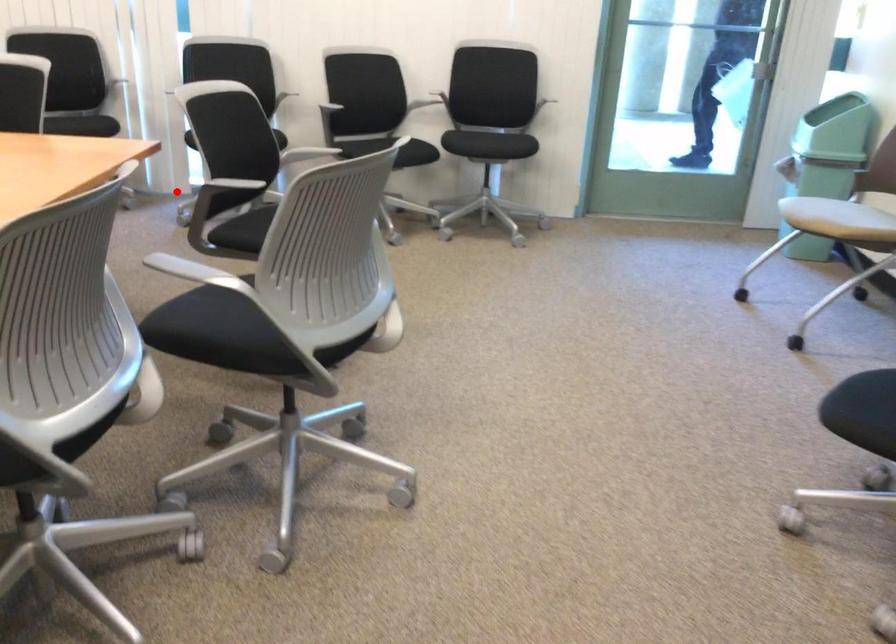
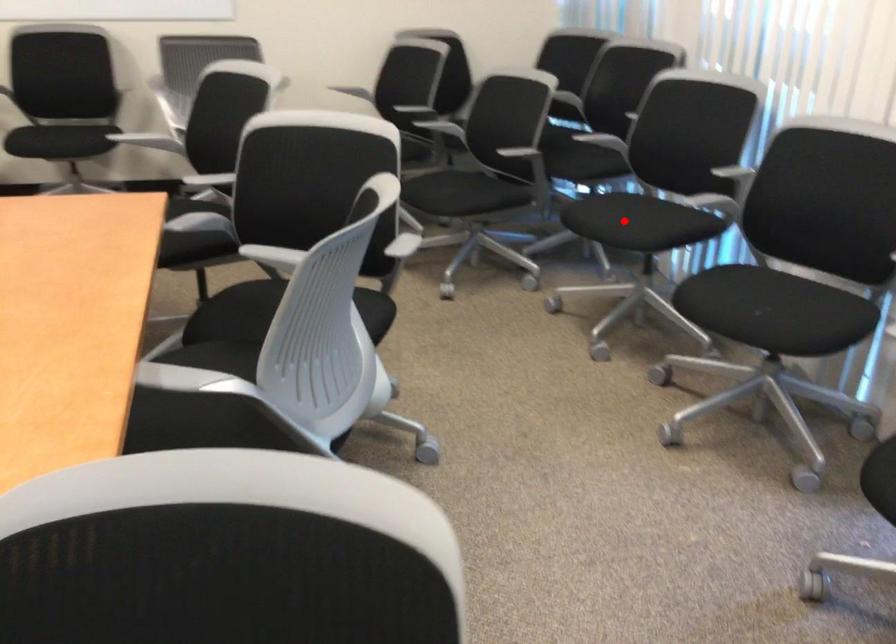
I am providing you with two images of the same scene from different viewpoints. A red point is marked on the first image and another point is marked on the second image. Do the highlighted points in image1 and image2 indicate the same real-world spot?

No